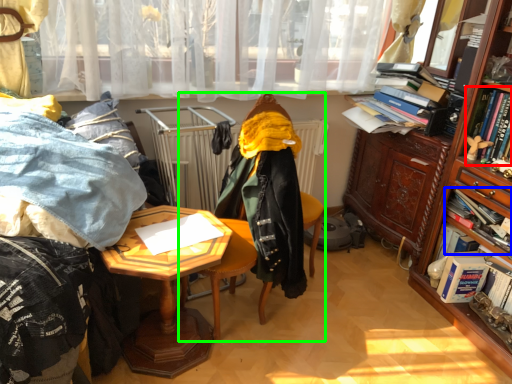
Question: Based on their relative distances, which object is nearer to book (highlighted by a red box)? Choose from book (highlighted by a blue box) and chair (highlighted by a green box).

Choices:
 (A) book
 (B) chair

Answer: (A)